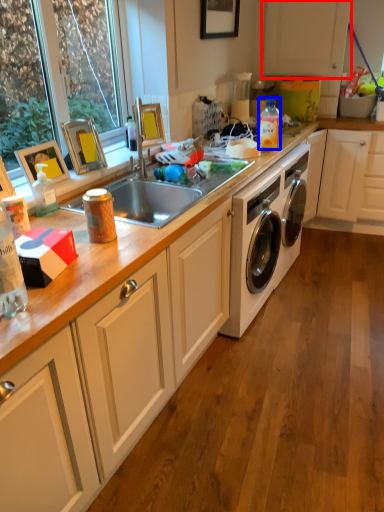
Question: Which point is further to the camera, cabinetry (highlighted by a red box) or bottle (highlighted by a blue box)?

Choices:
 (A) cabinetry
 (B) bottle

Answer: (A)